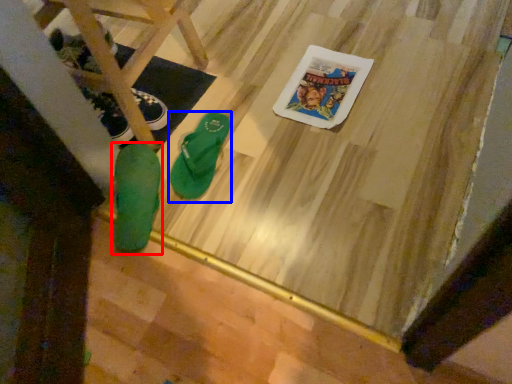
Question: Which object is closer to the camera taking this photo, footwear (highlighted by a red box) or footwear (highlighted by a blue box)?

Choices:
 (A) footwear
 (B) footwear

Answer: (A)